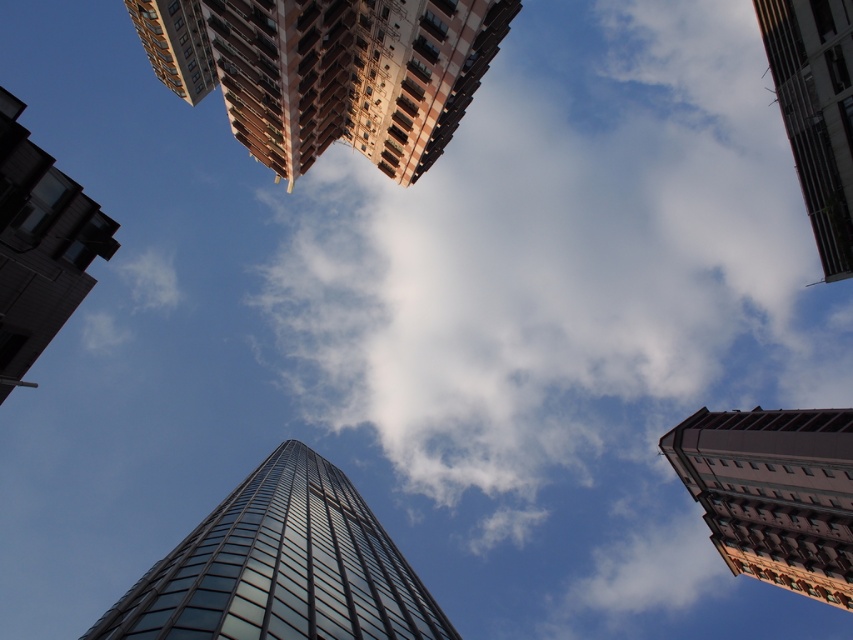
Question: Estimate the real-world distances between objects in this image. Which object is closer to the metallic glass skyscraper at upper right?

Choices:
 (A) glassy reflective building at left
 (B) brown textured building at right
 (C) transparent glass tower at center

Answer: (B)

Question: Does transparent glass tower at center have a greater width compared to brown textured building at right?

Choices:
 (A) no
 (B) yes

Answer: (B)

Question: Which object is the closest to the metallic glass skyscraper at upper right?

Choices:
 (A) transparent glass tower at center
 (B) brown textured building at upper center
 (C) brown textured building at right

Answer: (B)

Question: Where is transparent glass tower at center located in relation to brown textured building at right in the image?

Choices:
 (A) above
 (B) below

Answer: (B)

Question: Is brown textured building at upper center positioned at the back of transparent glass tower at center?

Choices:
 (A) no
 (B) yes

Answer: (B)

Question: Which object is positioned farthest from the glassy reflective building at left?

Choices:
 (A) transparent glass tower at center
 (B) metallic glass skyscraper at upper right
 (C) brown textured building at right

Answer: (C)